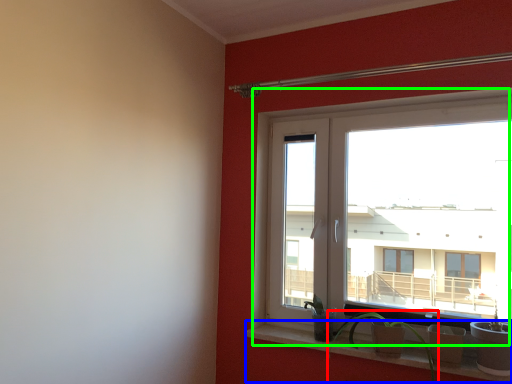
Question: Estimate the real-world distances between objects in this image. Which object is farther from houseplant (highlighted by a red box), window sill (highlighted by a blue box) or window (highlighted by a green box)?

Choices:
 (A) window sill
 (B) window

Answer: (B)